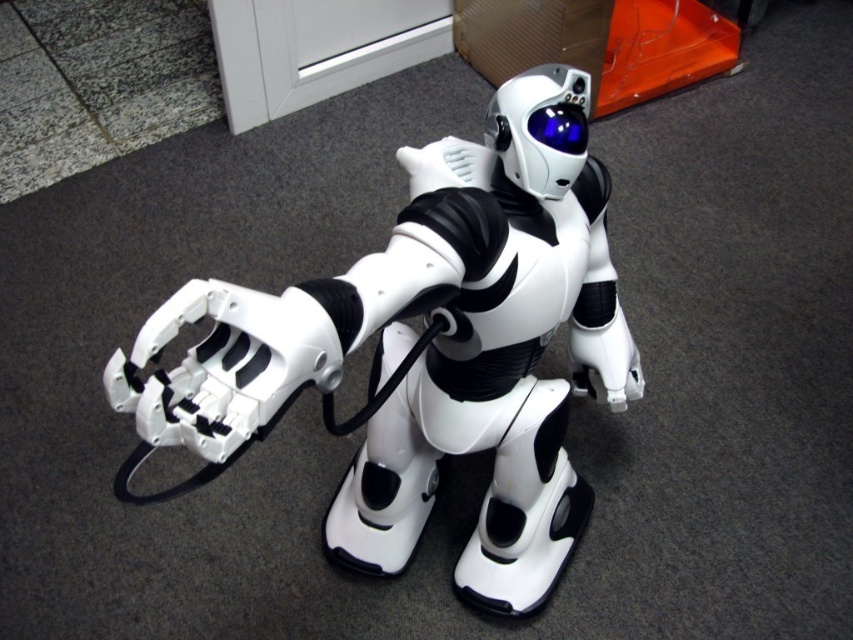
Who is more forward, (x=514, y=198) or (x=554, y=113)?

Point (x=554, y=113)

Can you confirm if white matte robot at center is positioned above glossy plastic goggles at upper center?

No.

Between point (477, 260) and point (577, 108), which one is positioned behind?

Positioned behind is point (577, 108).

At what (x,y) coordinates should I click in order to perform the action: click on white matte robot at center. Please return your answer as a coordinate pair (x, y). This screenshot has width=853, height=640. Looking at the image, I should click on (422, 355).